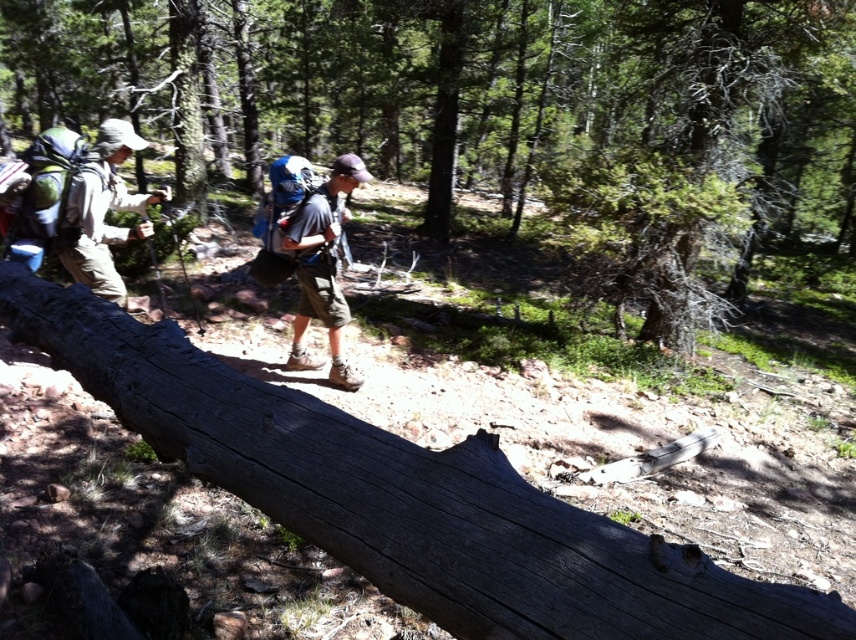
Question: Can you confirm if gray rough wood log at center is smaller than matte blue backpack at center?

Choices:
 (A) no
 (B) yes

Answer: (A)

Question: Which object appears closest to the camera in this image?

Choices:
 (A) matte khaki pants at left
 (B) matte blue backpack at center
 (C) gray rough wood log at center

Answer: (C)

Question: Is matte khaki pants at left to the left of matte blue backpack at center from the viewer's perspective?

Choices:
 (A) no
 (B) yes

Answer: (B)

Question: Can you confirm if smooth gray log at center is bigger than matte khaki pants at left?

Choices:
 (A) yes
 (B) no

Answer: (A)

Question: Which of these objects is positioned closest to the smooth gray log at center?

Choices:
 (A) gray rough wood log at center
 (B) matte blue backpack at center
 (C) matte khaki pants at left

Answer: (A)

Question: Which of the following is the farthest from the observer?

Choices:
 (A) gray rough wood log at center
 (B) matte blue backpack at center
 (C) matte khaki pants at left
 (D) smooth gray log at center

Answer: (D)